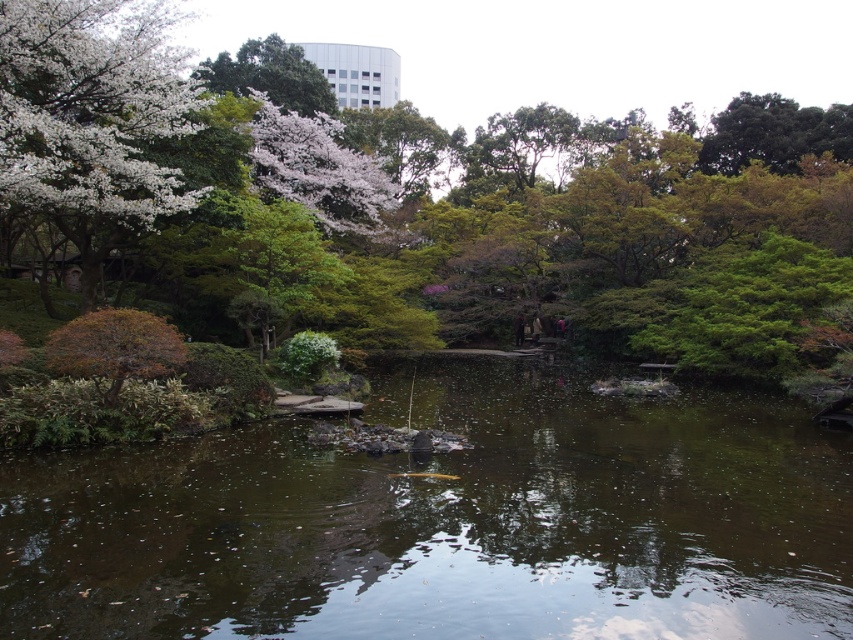
From the picture: Which is more to the right, green leafy tree at center or white blossoming tree at upper left?

Positioned to the right is green leafy tree at center.

Can you confirm if green leafy tree at center is bigger than white blossoming tree at upper left?

Indeed, green leafy tree at center has a larger size compared to white blossoming tree at upper left.

This screenshot has height=640, width=853. I want to click on green leafy tree at center, so click(430, 200).

Between brown murky water at center and white blossoming tree at upper left, which one has less height?

brown murky water at center

Which is above, brown murky water at center or white blossoming tree at upper left?

white blossoming tree at upper left is above.

Is point (515, 480) less distant than point (70, 44)?

Yes.

Locate an element on the screen. This screenshot has height=640, width=853. brown murky water at center is located at coordinates (447, 524).

Between green leafy tree at center and brown murky water at center, which one is positioned lower?

Positioned lower is brown murky water at center.

Can you confirm if green leafy tree at center is taller than brown murky water at center?

Yes.

Does point (554, 237) lie behind point (492, 444)?

Yes, it is.

The height and width of the screenshot is (640, 853). What are the coordinates of `green leafy tree at center` in the screenshot? It's located at (430, 200).